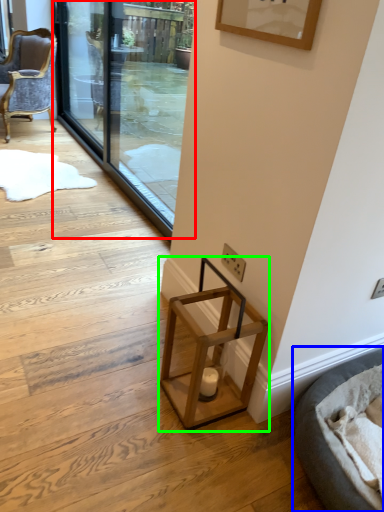
Question: Which object is the closest to the screen door (highlighted by a red box)? Choose among these: cat bed (highlighted by a blue box) or stool (highlighted by a green box).

Choices:
 (A) cat bed
 (B) stool

Answer: (B)